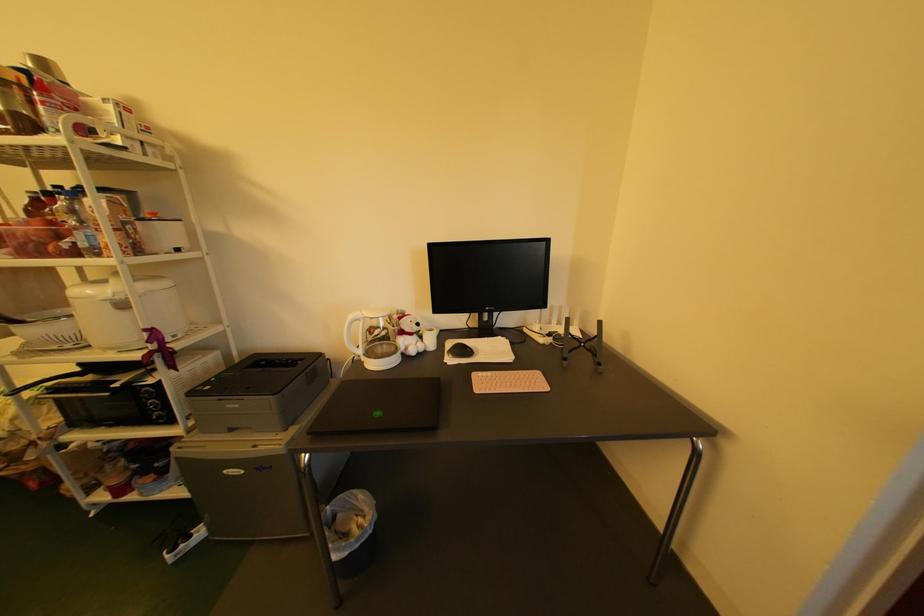
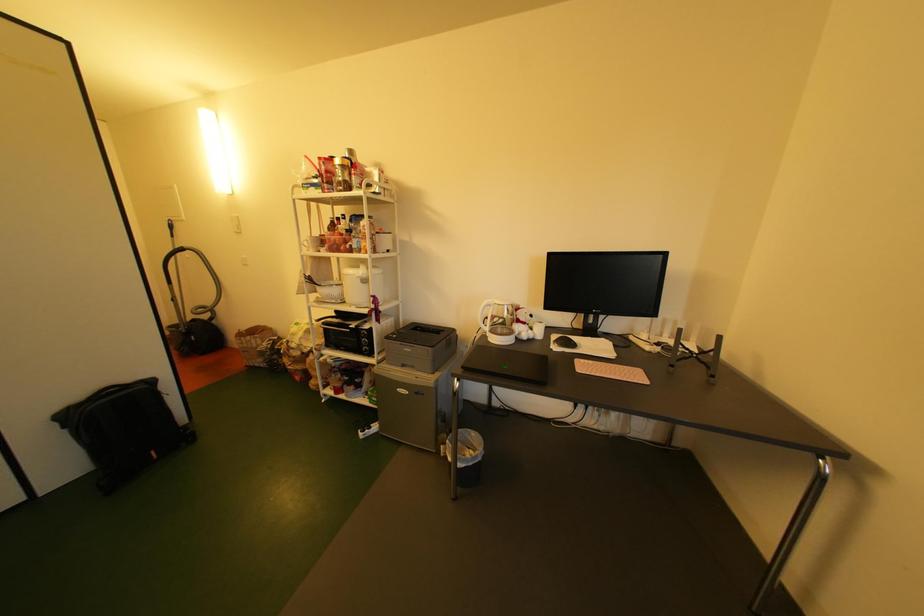
Question: Which direction would the cameraman need to move to produce the second image? Reply with the corresponding letter.

Choices:
 (A) Left
 (B) Right
 (C) Forward
 (D) Backward

Answer: (D)